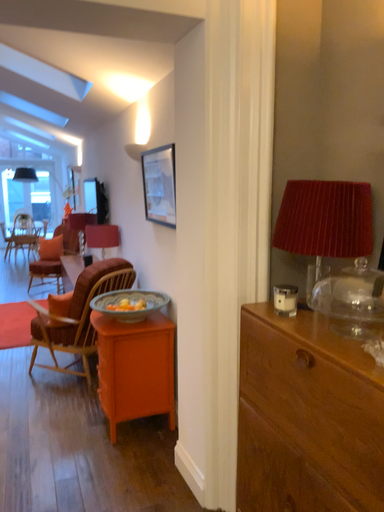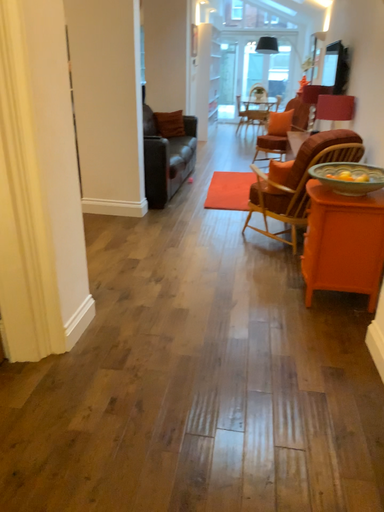
Question: How did the camera likely rotate when shooting the video?

Choices:
 (A) rotated left
 (B) rotated right

Answer: (A)